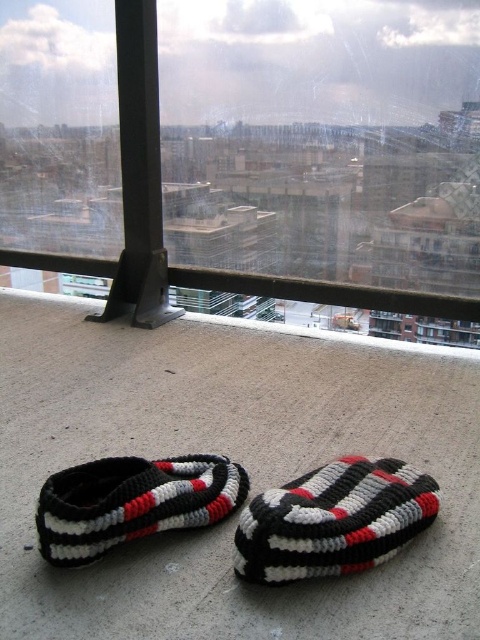
You are a delivery drone trying to land on the balcony. The transparent glass window at center and the knitted fabric slipper at lower center are in your path. Which object is wider, and should you adjust your landing path to avoid the wider one?

The transparent glass window at center is wider than the knitted fabric slipper at lower center, so you should adjust your landing path to avoid the wider transparent glass window at center.

You are standing on the balcony and want to place a small potted plant between the two points marked as point [383,19] and point [116,506]. Which point should the plant be closer to in order to be closer to the window?

The plant should be closer to point [383,19] because it is closer to the window than point [116,506].

You are standing on the balcony and want to place a small potted plant between the knitted fabric slipper at lower center and the window. The balcony floor has a coordinate system where the bottom left corner is the origin. The window is at position 1.0, 0.0. Can you place the plant at point (x=334, y=520)?

The knitted fabric slipper at lower center is already located at point (x=334, y=520), so you cannot place the plant there as it is occupied by the slipper.